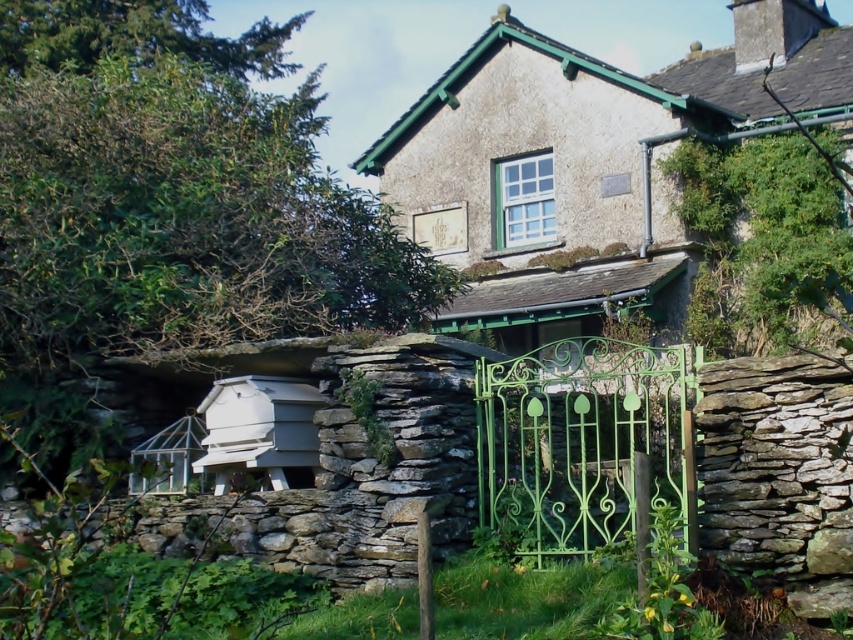
Question: Can you confirm if rustic stone cottage at center is wider than green wrought iron gate at center?

Choices:
 (A) no
 (B) yes

Answer: (B)

Question: Is rustic stone cottage at center above green wrought iron gate at center?

Choices:
 (A) no
 (B) yes

Answer: (B)

Question: Which point is closer to the camera taking this photo?

Choices:
 (A) (518, 92)
 (B) (585, 515)

Answer: (B)

Question: Can you confirm if rustic stone cottage at center is bigger than green wrought iron gate at center?

Choices:
 (A) yes
 (B) no

Answer: (A)